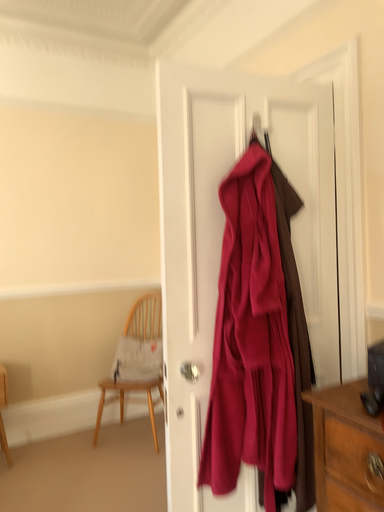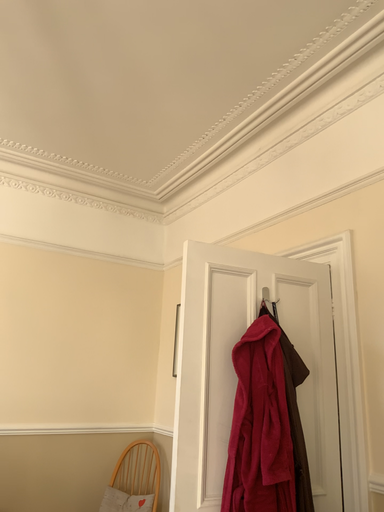
Question: How did the camera likely rotate when shooting the video?

Choices:
 (A) rotated upward
 (B) rotated downward

Answer: (A)